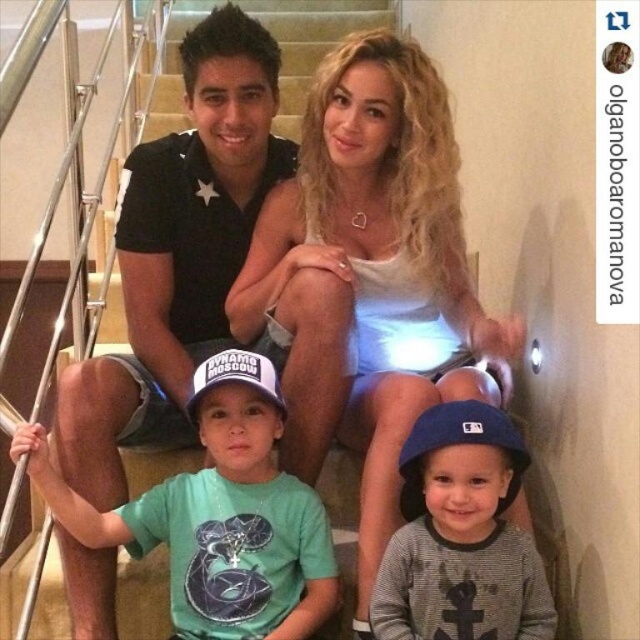
Between black cotton polo shirt at center and green cotton shirt at center, which one has less height?

With less height is green cotton shirt at center.

From the picture: Can you confirm if black cotton polo shirt at center is positioned above green cotton shirt at center?

Correct, black cotton polo shirt at center is located above green cotton shirt at center.

Identify the location of black cotton polo shirt at center. The height and width of the screenshot is (640, 640). (179, 252).

Who is more distant from viewer, (388, 97) or (500, 474)?

The point (388, 97) is more distant.

Measure the distance between point (396, 404) and camera.

A distance of 4.40 feet exists between point (396, 404) and camera.

The image size is (640, 640). What do you see at coordinates (369, 275) in the screenshot?
I see `white matte dress at center` at bounding box center [369, 275].

Identify the location of white matte dress at center. This screenshot has height=640, width=640. (369, 275).

Does black cotton polo shirt at center appear under gray fleece sweatshirt at lower center?

No, black cotton polo shirt at center is not below gray fleece sweatshirt at lower center.

Who is positioned more to the left, black cotton polo shirt at center or gray fleece sweatshirt at lower center?

From the viewer's perspective, black cotton polo shirt at center appears more on the left side.

Measure the distance between black cotton polo shirt at center and camera.

They are 1.21 meters apart.

I want to click on black cotton polo shirt at center, so click(179, 252).